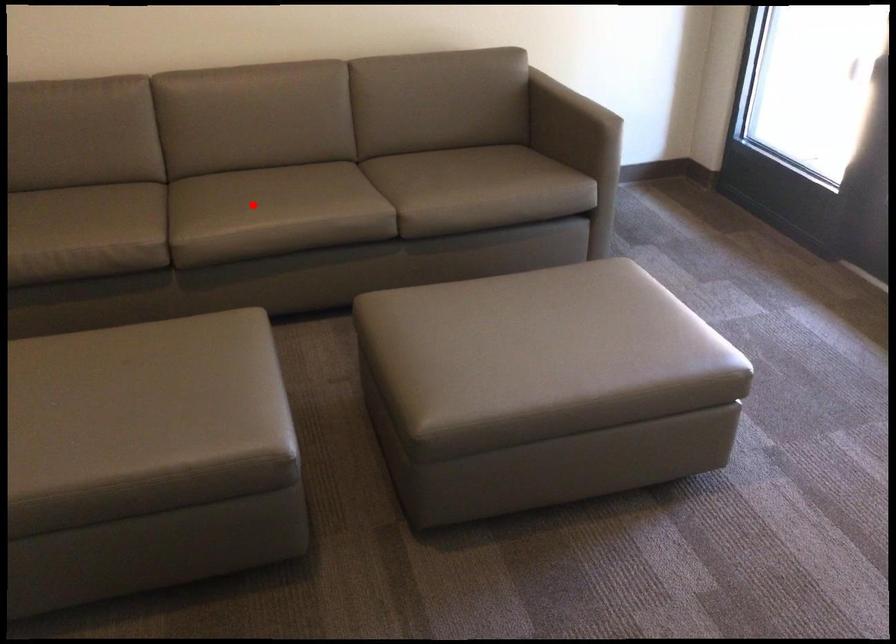
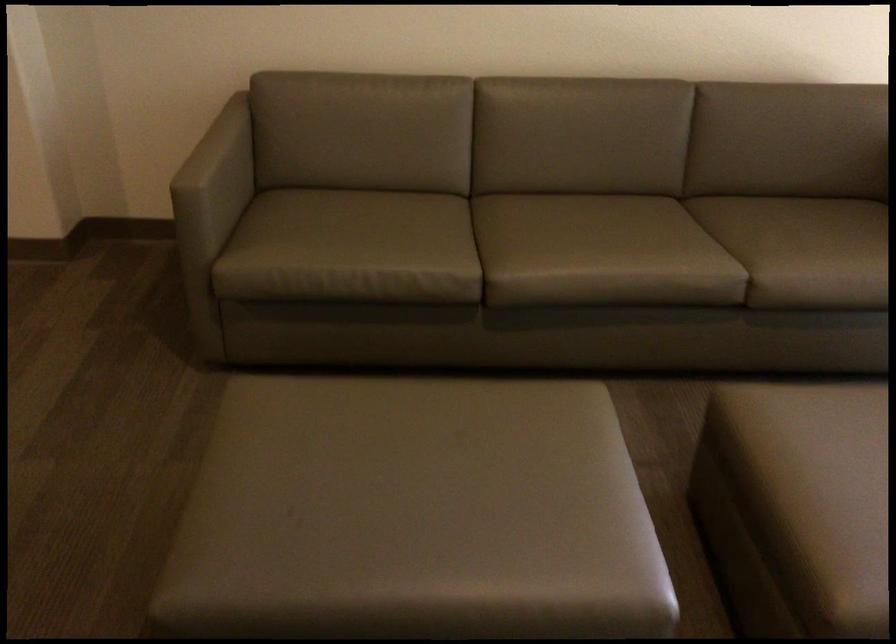
Question: A red point is marked in image1. In image2, is the corresponding 3D point closer to the camera or farther? Reply with the corresponding letter.

Choices:
 (A) The corresponding 3D point is closer.
 (B) The corresponding 3D point is farther.

Answer: (A)